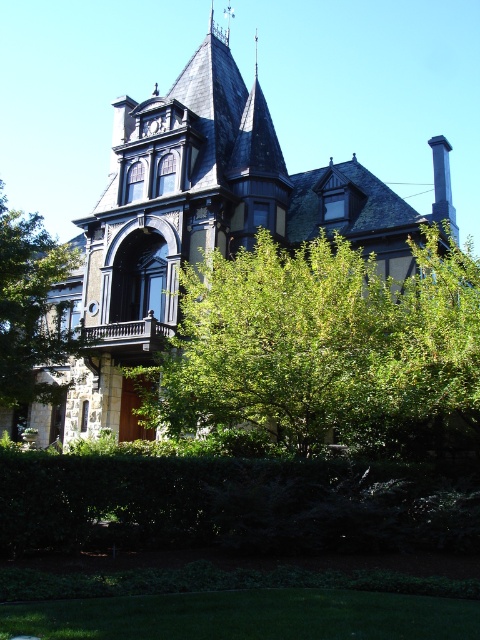
Question: Can you confirm if green leafy hedge at lower center is positioned to the left of green leafy tree at lower left?

Choices:
 (A) yes
 (B) no

Answer: (B)

Question: Is green leafy hedge at lower center above green leafy tree at lower left?

Choices:
 (A) yes
 (B) no

Answer: (B)

Question: Does dark gray stone mansion at center have a lesser width compared to green leafy tree at center?

Choices:
 (A) no
 (B) yes

Answer: (A)

Question: Which object appears closest to the camera in this image?

Choices:
 (A) green leafy tree at lower left
 (B) dark gray stone mansion at center
 (C) green leafy tree at center
 (D) green leafy hedge at lower center

Answer: (D)

Question: Based on their relative distances, which object is farther from the green leafy hedge at lower center?

Choices:
 (A) green leafy tree at lower left
 (B) dark gray stone mansion at center
 (C) green leafy tree at center

Answer: (B)

Question: Which of these objects is positioned closest to the green leafy tree at lower left?

Choices:
 (A) dark gray stone mansion at center
 (B) green leafy hedge at lower center
 (C) green leafy tree at center

Answer: (C)